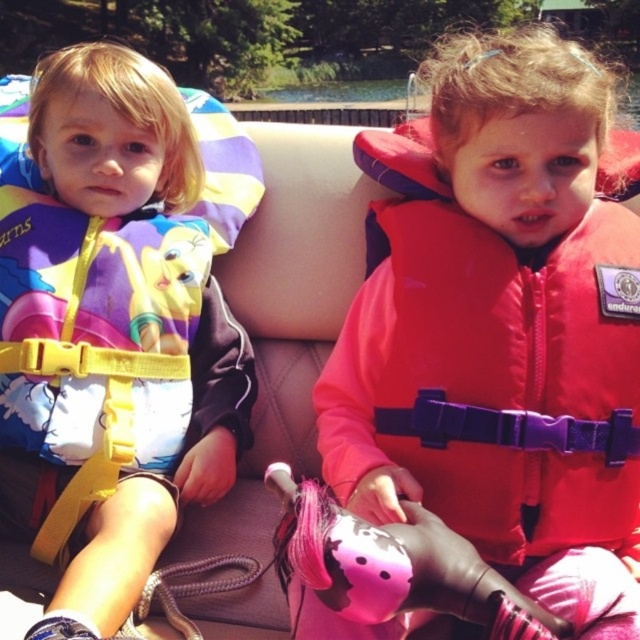
Question: Which object is closer to the camera taking this photo?

Choices:
 (A) matte yellow life vest at left
 (B) red/purple fabric life vest at center

Answer: (A)

Question: Which point is farther to the camera?

Choices:
 (A) red/purple fabric life vest at center
 (B) matte yellow life vest at left

Answer: (A)

Question: Is matte yellow life vest at left thinner than red/purple fabric life vest at center?

Choices:
 (A) yes
 (B) no

Answer: (A)

Question: Can you confirm if matte yellow life vest at left is positioned to the left of red/purple fabric life vest at center?

Choices:
 (A) no
 (B) yes

Answer: (B)

Question: Does matte yellow life vest at left have a larger size compared to red/purple fabric life vest at center?

Choices:
 (A) yes
 (B) no

Answer: (A)